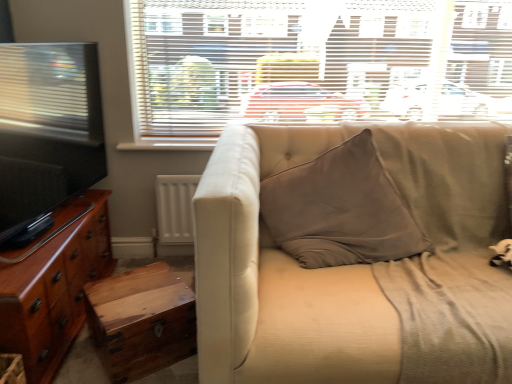
Question: Are beige fabric couch at center and white textured blinds at upper center far apart?

Choices:
 (A) yes
 (B) no

Answer: (B)

Question: Can you confirm if beige fabric couch at center is wider than white textured blinds at upper center?

Choices:
 (A) no
 (B) yes

Answer: (B)

Question: Considering the relative sizes of beige fabric couch at center and white textured blinds at upper center in the image provided, is beige fabric couch at center thinner than white textured blinds at upper center?

Choices:
 (A) no
 (B) yes

Answer: (A)

Question: Is beige fabric couch at center closer to camera compared to white textured blinds at upper center?

Choices:
 (A) yes
 (B) no

Answer: (A)

Question: From a real-world perspective, does beige fabric couch at center stand above white textured blinds at upper center?

Choices:
 (A) yes
 (B) no

Answer: (B)

Question: Is glossy wood cabinet at left inside or outside of beige fabric couch at center?

Choices:
 (A) inside
 (B) outside

Answer: (B)

Question: From a real-world perspective, relative to beige fabric couch at center, is glossy wood cabinet at left vertically above or below?

Choices:
 (A) below
 (B) above

Answer: (A)

Question: Considering the positions of point (81, 226) and point (380, 294), is point (81, 226) closer or farther from the camera than point (380, 294)?

Choices:
 (A) farther
 (B) closer

Answer: (A)

Question: From the image's perspective, is glossy wood cabinet at left located above or below beige fabric couch at center?

Choices:
 (A) above
 (B) below

Answer: (B)

Question: Is point (89, 264) positioned closer to the camera than point (192, 54)?

Choices:
 (A) closer
 (B) farther

Answer: (A)

Question: In terms of width, does glossy wood cabinet at left look wider or thinner when compared to white textured blinds at upper center?

Choices:
 (A) thin
 (B) wide

Answer: (B)

Question: Do you think glossy wood cabinet at left is within white textured blinds at upper center, or outside of it?

Choices:
 (A) inside
 (B) outside

Answer: (B)

Question: From the image's perspective, relative to white textured blinds at upper center, is glossy wood cabinet at left above or below?

Choices:
 (A) below
 (B) above

Answer: (A)

Question: Looking at the image, does white textured blinds at upper center seem bigger or smaller compared to wooden trunk at lower left?

Choices:
 (A) small
 (B) big

Answer: (B)

Question: From a real-world perspective, is white textured blinds at upper center above or below wooden trunk at lower left?

Choices:
 (A) above
 (B) below

Answer: (A)